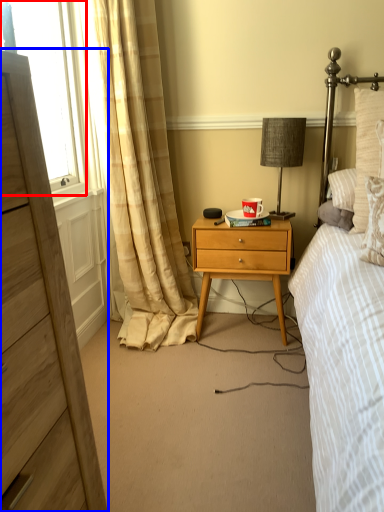
Question: Which object appears farthest to the camera in this image, window screen (highlighted by a red box) or chest of drawers (highlighted by a blue box)?

Choices:
 (A) window screen
 (B) chest of drawers

Answer: (A)